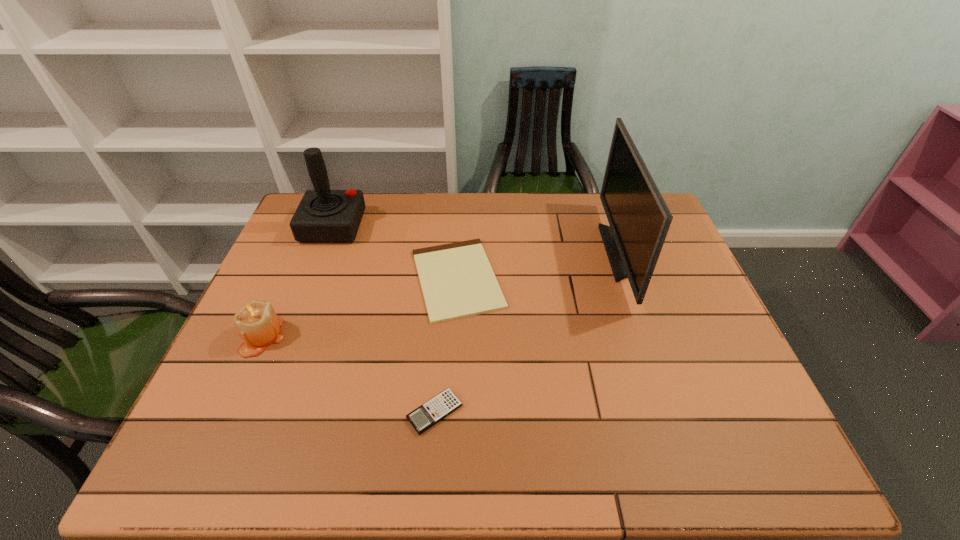
Where is `vacant space located on the right of the third tallest object`? vacant space located on the right of the third tallest object is located at coordinates (404, 336).

Image resolution: width=960 pixels, height=540 pixels. What are the coordinates of `vacant space positioned 0.160m on the back of the calculator` in the screenshot? It's located at (441, 335).

Find the location of a particular element. This screenshot has height=540, width=960. vacant space located 0.210m on the right of the clipboard is located at coordinates (580, 279).

Locate an element on the screen. The height and width of the screenshot is (540, 960). monitor that is at the far edge is located at coordinates (639, 218).

What are the coordinates of `joystick at the far edge` in the screenshot? It's located at (323, 216).

What are the coordinates of `object positioned at the near edge` in the screenshot? It's located at (439, 407).

I want to click on joystick positioned at the left edge, so click(x=323, y=216).

The height and width of the screenshot is (540, 960). What are the coordinates of `candle that is at the left edge` in the screenshot? It's located at click(x=257, y=323).

Find the location of `object that is at the right edge`. object that is at the right edge is located at coordinates tap(639, 218).

This screenshot has width=960, height=540. In order to click on object that is at the far left corner in this screenshot , I will do `click(323, 216)`.